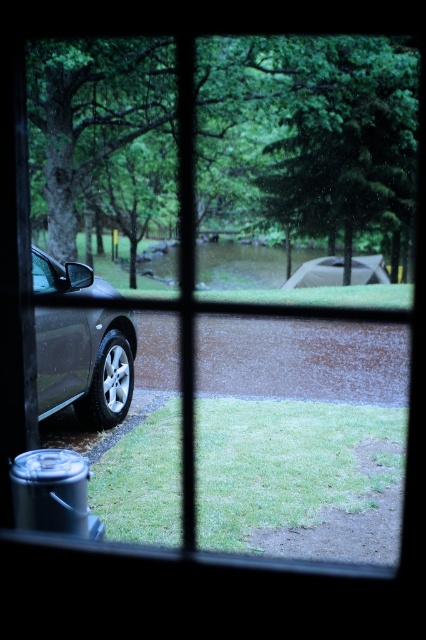
You are driving a car and want to exit the parking lot. You see a green leafy tree at upper left and a matte black car at left. Which object is closer to you as you look through the window?

The green leafy tree at upper left is closer to you because the matte black car at left is behind it.

You are sitting inside a car parked on the left side of the frame and looking through the window. There are two points marked in the scene. The first point is at coordinate point (313, 230) and the second point is at coordinate point (83, 417). From your current position inside the car, which point is closer to you?

Point (83, 417) is closer to you because the description states that point (313, 230) is behind point (83, 417), meaning the latter is in front and therefore nearer to your position inside the car.

You are a passenger in a car and looking through the window. You see a green leafy tree at upper left and a matte black car at left. Which object is closer to the left edge of the window?

The matte black car at left is closer to the left edge of the window because the green leafy tree at upper left is positioned on the right side of the matte black car at left.